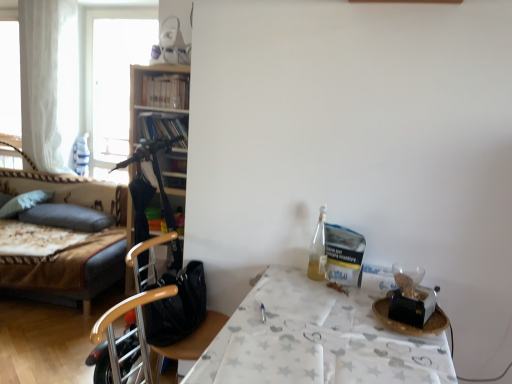
What do you see at coordinates (64, 239) in the screenshot? I see `velvet-like brown bed at left` at bounding box center [64, 239].

At what (x,y) coordinates should I click in order to perform the action: click on wooden bookshelf at upper left. Please return your answer as a coordinate pair (x, y). The height and width of the screenshot is (384, 512). Looking at the image, I should click on (160, 86).

Find the location of a particular element. This screenshot has height=384, width=512. soft gray pillow at left, acting as the 2th pillow starting from the right is located at coordinates (24, 202).

What do you see at coordinates (67, 217) in the screenshot?
I see `dark gray fabric pillow at left, the 1th pillow when ordered from right to left` at bounding box center [67, 217].

In order to face transparent glass window at upper left, should I rotate leftwards or rightwards?

To face it directly, rotate left by 18.075 degrees.

Find the location of `velvet-like brown bed at left`. velvet-like brown bed at left is located at coordinates (64, 239).

Who is bigger, white paper table at right or soft gray pillow at left, the first pillow viewed from the left?

white paper table at right.

Between white paper table at right and soft gray pillow at left, the first pillow viewed from the left, which one has smaller width?

With smaller width is soft gray pillow at left, the first pillow viewed from the left.

Based on the photo, is white paper table at right next to soft gray pillow at left, the first pillow viewed from the left, and touching it?

No, white paper table at right is not beside soft gray pillow at left, the first pillow viewed from the left.

In terms of height, does white paper table at right look taller or shorter compared to soft gray pillow at left, the first pillow viewed from the left?

In the image, white paper table at right appears to be taller than soft gray pillow at left, the first pillow viewed from the left.

From the image's perspective, which one is positioned lower, wooden chair at center or dark gray fabric pillow at left, positioned as the 2th pillow in left-to-right order?

wooden chair at center appears lower in the image.

Is wooden chair at center surrounding dark gray fabric pillow at left, the 1th pillow when ordered from right to left?

That's incorrect, dark gray fabric pillow at left, the 1th pillow when ordered from right to left, is not inside wooden chair at center.

Does wooden chair at center appear on the right side of dark gray fabric pillow at left, the 1th pillow when ordered from right to left?

Correct, you'll find wooden chair at center to the right of dark gray fabric pillow at left, the 1th pillow when ordered from right to left.

Considering the sizes of objects wooden chair at center and dark gray fabric pillow at left, positioned as the 2th pillow in left-to-right order, in the image provided, who is smaller, wooden chair at center or dark gray fabric pillow at left, positioned as the 2th pillow in left-to-right order,?

dark gray fabric pillow at left, positioned as the 2th pillow in left-to-right order.

In the scene shown: Is transparent glass window at upper left completely or partially inside wooden chair at center?

No, transparent glass window at upper left is not a part of wooden chair at center.

Considering the sizes of objects wooden chair at center and transparent glass window at upper left in the image provided, who is wider, wooden chair at center or transparent glass window at upper left?

Wider between the two is wooden chair at center.

Is point (193, 359) closer or farther from the camera than point (102, 125)?

Point (193, 359) is positioned closer to the camera compared to point (102, 125).

From the image's perspective, which one is positioned lower, wooden chair at center or transparent glass window at upper left?

From the image's view, wooden chair at center is below.

Considering the sizes of objects white sheer curtain at left and dark gray fabric pillow at left, positioned as the 2th pillow in left-to-right order, in the image provided, who is taller, white sheer curtain at left or dark gray fabric pillow at left, positioned as the 2th pillow in left-to-right order,?

white sheer curtain at left.

From a real-world perspective, is white sheer curtain at left over dark gray fabric pillow at left, the 1th pillow when ordered from right to left?

Yes, from a real-world perspective, white sheer curtain at left is over dark gray fabric pillow at left, the 1th pillow when ordered from right to left

Is white sheer curtain at left next to dark gray fabric pillow at left, positioned as the 2th pillow in left-to-right order?

No, white sheer curtain at left is not beside dark gray fabric pillow at left, positioned as the 2th pillow in left-to-right order.

Could you tell me if wooden bookshelf at upper left is facing velvet-like brown bed at left?

No.

This screenshot has height=384, width=512. What are the coordinates of `bed located in front of the wooden bookshelf at upper left` in the screenshot? It's located at (64, 239).

Choose the correct answer: Is wooden bookshelf at upper left inside velvet-like brown bed at left or outside it?

wooden bookshelf at upper left cannot be found inside velvet-like brown bed at left.

Between dark gray fabric pillow at left, positioned as the 2th pillow in left-to-right order, and wooden chair at center, which one has larger size?

wooden chair at center is bigger.

Is wooden chair at center at the back of dark gray fabric pillow at left, positioned as the 2th pillow in left-to-right order?

No, wooden chair at center is not at the back of dark gray fabric pillow at left, positioned as the 2th pillow in left-to-right order.

Can you see dark gray fabric pillow at left, the 1th pillow when ordered from right to left, touching wooden chair at center?

No.

From a real-world perspective, relative to wooden chair at center, is dark gray fabric pillow at left, positioned as the 2th pillow in left-to-right order, vertically above or below?

From a real-world perspective, dark gray fabric pillow at left, positioned as the 2th pillow in left-to-right order, is physically below wooden chair at center.

Based on their positions, is dark gray fabric pillow at left, the 1th pillow when ordered from right to left, located to the left or right of white sheer curtain at left?

From the image, it's evident that dark gray fabric pillow at left, the 1th pillow when ordered from right to left, is to the right of white sheer curtain at left.

Considering the sizes of objects dark gray fabric pillow at left, the 1th pillow when ordered from right to left, and white sheer curtain at left in the image provided, who is smaller, dark gray fabric pillow at left, the 1th pillow when ordered from right to left, or white sheer curtain at left?

Smaller between the two is dark gray fabric pillow at left, the 1th pillow when ordered from right to left.

Could you tell me if dark gray fabric pillow at left, the 1th pillow when ordered from right to left, is turned towards white sheer curtain at left?

No, dark gray fabric pillow at left, the 1th pillow when ordered from right to left, is not aimed at white sheer curtain at left.

At what (x,y) coordinates should I click in order to perform the action: click on the 2nd pillow directly above the white paper table at right (from a real-world perspective). Please return your answer as a coordinate pair (x, y). This screenshot has height=384, width=512. Looking at the image, I should click on (24, 202).

Which pillow is the 1st one when counting from the back of the wooden chair at center? Please provide its 2D coordinates.

[(67, 217)]

Which object lies nearer to the anchor point soft gray pillow at left, acting as the 2th pillow starting from the right, dark gray fabric pillow at left, positioned as the 2th pillow in left-to-right order, or wooden bookshelf at upper left?

dark gray fabric pillow at left, positioned as the 2th pillow in left-to-right order.

Estimate the real-world distances between objects in this image. Which object is closer to soft gray pillow at left, acting as the 2th pillow starting from the right, white sheer curtain at left or transparent glass window at upper left?

Among the two, white sheer curtain at left is located nearer to soft gray pillow at left, acting as the 2th pillow starting from the right.

Estimate the real-world distances between objects in this image. Which object is further from dark gray fabric pillow at left, the 1th pillow when ordered from right to left, velvet-like brown bed at left or wooden chair at center?

wooden chair at center lies further to dark gray fabric pillow at left, the 1th pillow when ordered from right to left, than the other object.

When comparing their distances from soft gray pillow at left, the first pillow viewed from the left, does white sheer curtain at left or dark gray fabric pillow at left, positioned as the 2th pillow in left-to-right order, seem further?

The object further to soft gray pillow at left, the first pillow viewed from the left, is white sheer curtain at left.

Based on their spatial positions, is transparent glass window at upper left or wooden bookshelf at upper left further from soft gray pillow at left, acting as the 2th pillow starting from the right?

wooden bookshelf at upper left is positioned further to the anchor soft gray pillow at left, acting as the 2th pillow starting from the right.

Considering their positions, is white sheer curtain at left positioned closer to soft gray pillow at left, the first pillow viewed from the left, than white paper table at right?

Among the two, white sheer curtain at left is located nearer to soft gray pillow at left, the first pillow viewed from the left.

Considering their positions, is wooden chair at center positioned closer to white paper table at right than velvet-like brown bed at left?

wooden chair at center lies closer to white paper table at right than the other object.

From the image, which object appears to be nearer to wooden chair at center, soft gray pillow at left, the first pillow viewed from the left, or velvet-like brown bed at left?

velvet-like brown bed at left.

Where is `shelf positioned between wooden chair at center and dark gray fabric pillow at left, the 1th pillow when ordered from right to left, from near to far`? shelf positioned between wooden chair at center and dark gray fabric pillow at left, the 1th pillow when ordered from right to left, from near to far is located at coordinates (160, 86).

At what (x,y) coordinates should I click in order to perform the action: click on chair between white paper table at right and wooden bookshelf at upper left from front to back. Please return your answer as a coordinate pair (x, y). This screenshot has width=512, height=384. Looking at the image, I should click on (192, 341).

The width and height of the screenshot is (512, 384). In order to click on shelf located between white paper table at right and soft gray pillow at left, the first pillow viewed from the left, in the depth direction in this screenshot , I will do 160,86.

The width and height of the screenshot is (512, 384). I want to click on chair between velvet-like brown bed at left and white paper table at right in the horizontal direction, so click(192, 341).